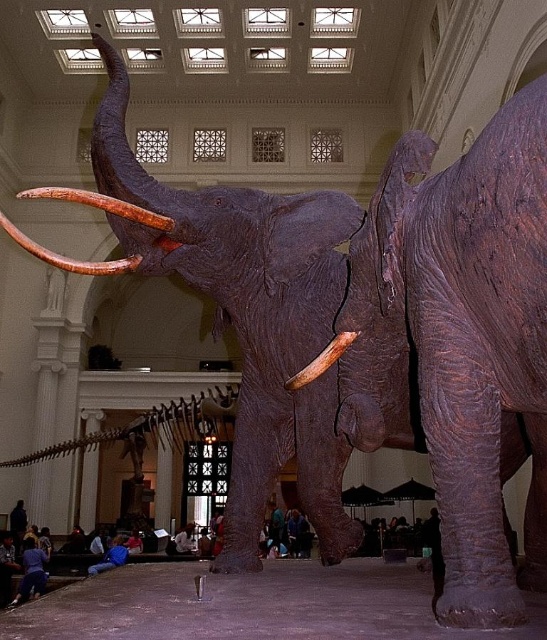
You are a visitor in the museum and want to take a photo of the brown polished tusk at left and the blue fabric pants at lower center. Which object should you focus on first if you want to capture both in one frame without moving the camera?

You should focus on the blue fabric pants at lower center first because it occupies more space than the brown polished tusk at left, making it easier to fit both into the frame by centering the larger object.

You are a museum visitor who wants to take a photo of the brown wood tusk at center and the blue fabric shirt at lower left. Which object should you focus on first if you want to capture both in a single frame without moving your camera?

You should focus on the brown wood tusk at center first because it is larger in size than the blue fabric shirt at lower left, allowing it to be more prominent in the frame while still including the smaller object.